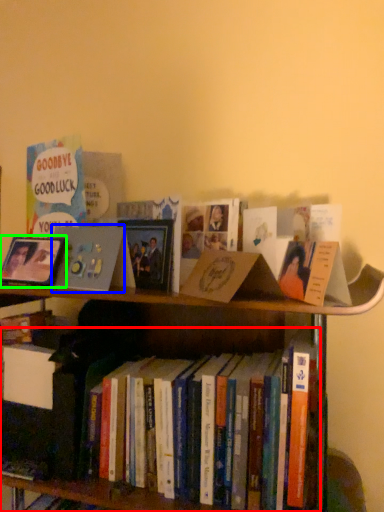
Question: Which object is the closest to the book (highlighted by a red box)? Choose among these: book cover (highlighted by a blue box) or picture frame (highlighted by a green box).

Choices:
 (A) book cover
 (B) picture frame

Answer: (A)